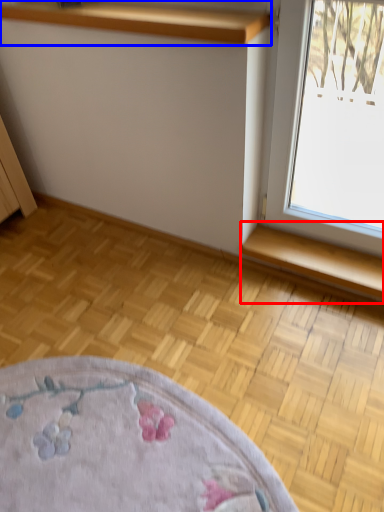
Question: Among these objects, which one is farthest to the camera, window sill (highlighted by a red box) or shelf (highlighted by a blue box)?

Choices:
 (A) window sill
 (B) shelf

Answer: (A)